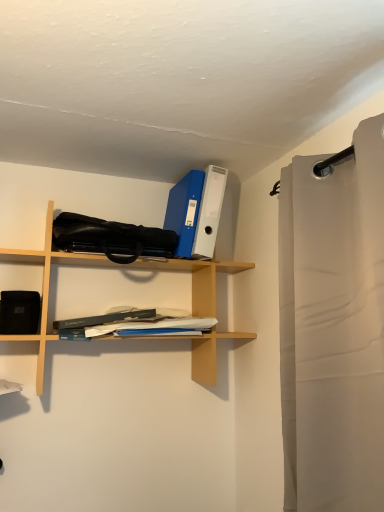
Question: From the image's perspective, is white paper at center located above or below black matte speaker at left?

Choices:
 (A) below
 (B) above

Answer: (A)

Question: In the image, is white paper at center on the left side or the right side of black matte speaker at left?

Choices:
 (A) left
 (B) right

Answer: (B)

Question: Which object is the farthest from the light beige fabric shower curtain at right?

Choices:
 (A) wooden shelf at upper center
 (B) white paper at center
 (C) black matte speaker at left

Answer: (C)

Question: Which is farther from the black matte speaker at left?

Choices:
 (A) light beige fabric shower curtain at right
 (B) wooden shelf at upper center
 (C) white paper at center

Answer: (A)